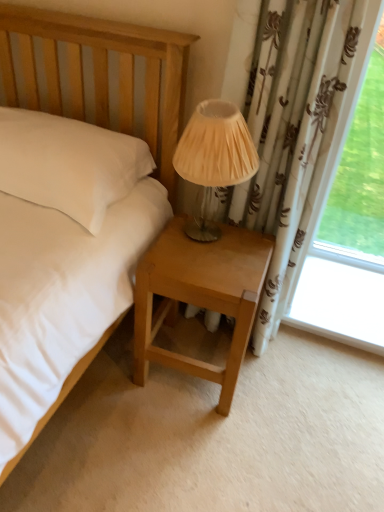
You are a GUI agent. You are given a task and a screenshot of the screen. Output one action in this format:
    pyautogui.click(x=<x>, y=<y>)
    Task: Click on the free space in front of matte beige fabric lampshade at center
    The height and width of the screenshot is (512, 384).
    Given the screenshot: What is the action you would take?
    pyautogui.click(x=209, y=269)